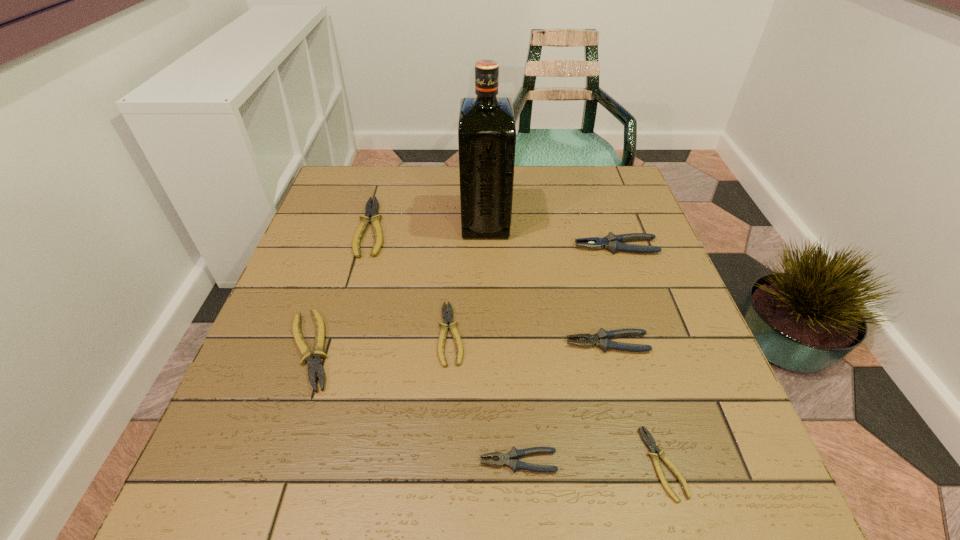
Where is `the tallest object`? The height and width of the screenshot is (540, 960). the tallest object is located at coordinates (486, 133).

This screenshot has height=540, width=960. Identify the location of the biggest gray pliers. (612, 242).

Find the location of a particular element. the tallest pliers is located at coordinates pos(612,242).

You are a GUI agent. You are given a task and a screenshot of the screen. Output one action in this format:
    pyautogui.click(x=<x>, y=<y>)
    Task: Click on the second nearest gray pliers
    The width and height of the screenshot is (960, 540).
    Given the screenshot: What is the action you would take?
    pyautogui.click(x=601, y=339)

Where is `the farthest yellow pliers`? This screenshot has width=960, height=540. the farthest yellow pliers is located at coordinates (371, 212).

Image resolution: width=960 pixels, height=540 pixels. What are the coordinates of `the second biggest yellow pliers` in the screenshot? It's located at (315, 366).

The width and height of the screenshot is (960, 540). What are the coordinates of `the leftmost gray pliers` in the screenshot? It's located at [x=513, y=454].

Locate an element on the screen. The width and height of the screenshot is (960, 540). the smallest gray pliers is located at coordinates (513, 454).

Where is `the third biggest yellow pliers`? the third biggest yellow pliers is located at coordinates (447, 317).

You are a GUI agent. You are given a task and a screenshot of the screen. Output one action in this format:
    pyautogui.click(x=<x>, y=<y>)
    Task: Click on the fifth pliers from right to left
    This screenshot has width=960, height=540.
    Given the screenshot: What is the action you would take?
    pyautogui.click(x=447, y=317)